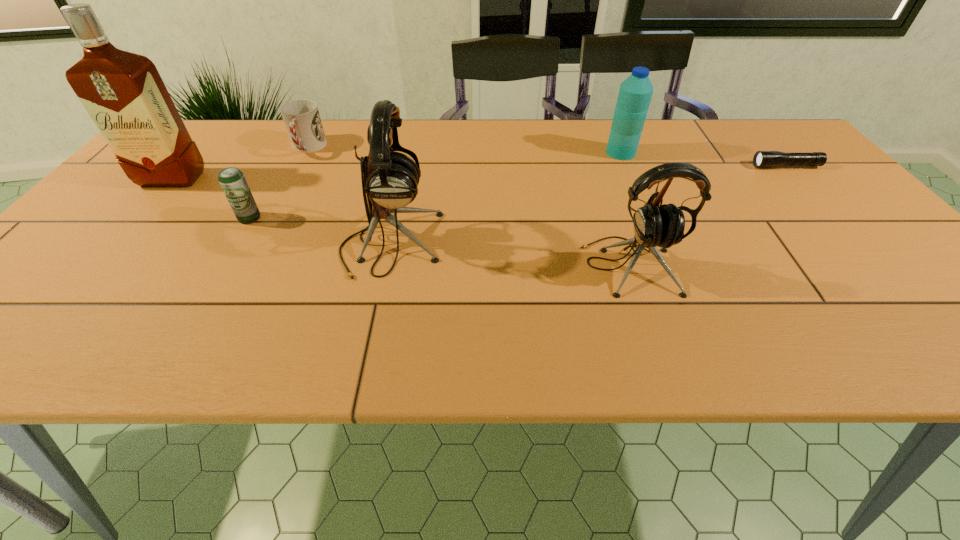
Identify the location of the taller earphone. (390, 180).

The width and height of the screenshot is (960, 540). Find the location of `the second tallest object`. the second tallest object is located at coordinates (390, 180).

The width and height of the screenshot is (960, 540). In order to click on the shorter earphone in this screenshot , I will do `click(663, 226)`.

Where is `water bottle`? The height and width of the screenshot is (540, 960). water bottle is located at coordinates (635, 93).

At what (x,y) coordinates should I click in order to perform the action: click on the tallest object. Please return your answer as a coordinate pair (x, y). The height and width of the screenshot is (540, 960). Looking at the image, I should click on (123, 92).

Where is `the leftmost object`? the leftmost object is located at coordinates (123, 92).

Identify the location of cup. This screenshot has width=960, height=540. (301, 117).

Identify the location of the rightmost object. The height and width of the screenshot is (540, 960). (761, 158).

Image resolution: width=960 pixels, height=540 pixels. What are the coordinates of `the shortest object` in the screenshot? It's located at (761, 158).

Find the location of a particular element. Image resolution: width=960 pixels, height=540 pixels. beer can is located at coordinates (232, 180).